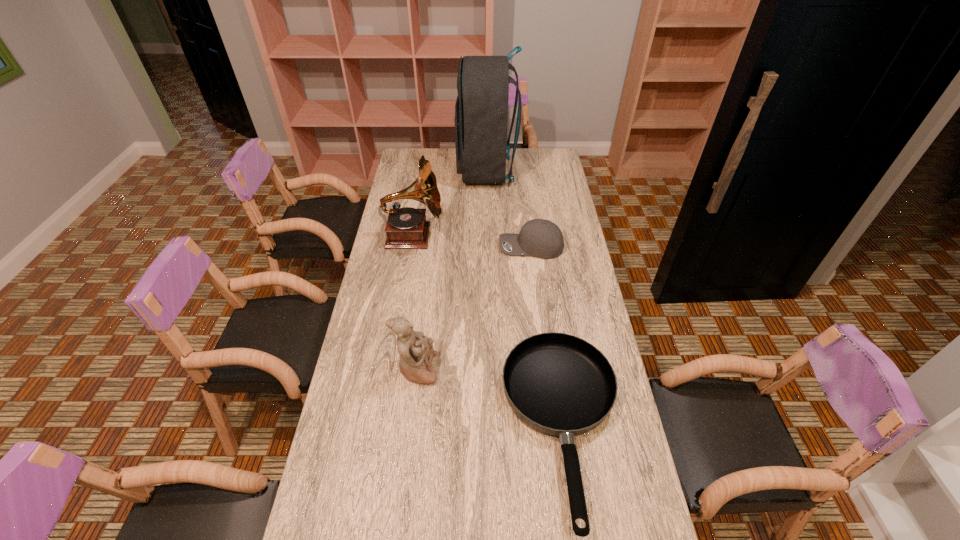
Locate an element on the screen. The width and height of the screenshot is (960, 540). free space at the far left corner of the desktop is located at coordinates (424, 153).

Locate an element on the screen. This screenshot has width=960, height=540. vacant area that lies between the figurine and the farthest object is located at coordinates (451, 269).

Identify the location of unoccupied area between the figurine and the farthest object. (451, 269).

Find the location of a particular element. empty location between the backpack and the figurine is located at coordinates (451, 269).

Identify the location of vacant region between the figurine and the farthest object. (451, 269).

This screenshot has width=960, height=540. In order to click on vacant area between the third shortest object and the backpack in this screenshot , I will do [x=451, y=269].

I want to click on vacant point located between the tallest object and the second shortest object, so click(509, 208).

Locate an element on the screen. empty space that is in between the backpack and the baseball cap is located at coordinates (509, 208).

Locate which object ranks third in proximity to the backpack. Please provide its 2D coordinates. Your answer should be formatted as a tuple, i.e. [(x, y)], where the tuple contains the x and y coordinates of a point satisfying the conditions above.

[(558, 384)]

You are a GUI agent. You are given a task and a screenshot of the screen. Output one action in this format:
    pyautogui.click(x=<x>, y=<y>)
    Task: Click on the object that stands as the closest to the second shortest object
    This screenshot has height=540, width=960.
    Given the screenshot: What is the action you would take?
    (x=406, y=227)